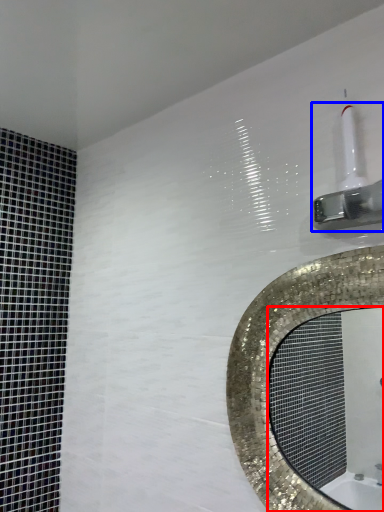
Question: Which of the following is the farthest to the observer, mirror (highlighted by a red box) or shower (highlighted by a blue box)?

Choices:
 (A) mirror
 (B) shower

Answer: (A)